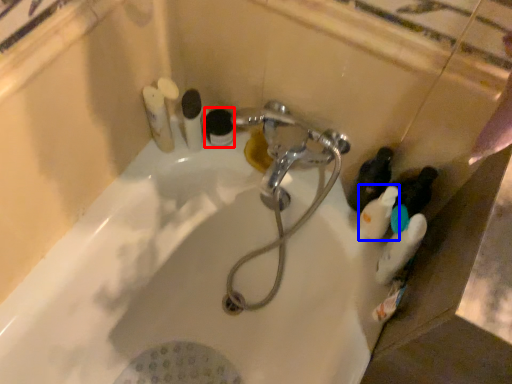
Question: Which object is closer to the camera taking this photo, toiletry (highlighted by a red box) or toiletry (highlighted by a blue box)?

Choices:
 (A) toiletry
 (B) toiletry

Answer: (B)